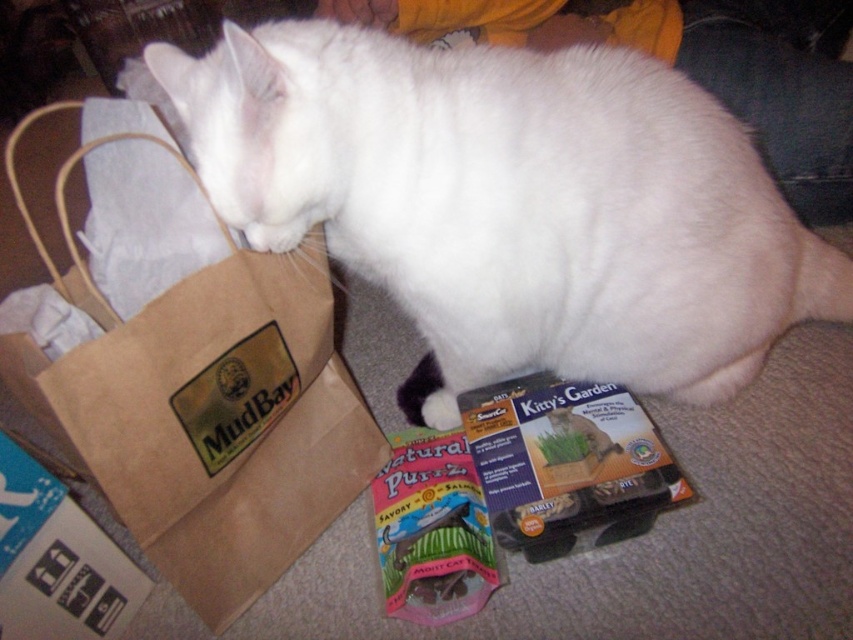
Measure the distance from brown paper bag at left to matte cardboard box at lower center.

brown paper bag at left and matte cardboard box at lower center are 33.41 centimeters apart from each other.

Which of these two, brown paper bag at left or matte cardboard box at lower center, stands taller?

brown paper bag at left

Is point (26, 216) behind point (645, 486)?

That is False.

The width and height of the screenshot is (853, 640). Identify the location of brown paper bag at left. (202, 404).

Can you confirm if white fur cat at upper left is bigger than blue cardboard box at lower left?

Yes.

Between white fur cat at upper left and blue cardboard box at lower left, which one appears on the right side from the viewer's perspective?

white fur cat at upper left is more to the right.

Which is behind, point (788, 323) or point (25, 636)?

The point (788, 323) is behind.

Locate an element on the screen. The width and height of the screenshot is (853, 640). white fur cat at upper left is located at coordinates (509, 204).

Find the location of a particular element. The width and height of the screenshot is (853, 640). brown paper bag at left is located at coordinates (202, 404).

What do you see at coordinates (202, 404) in the screenshot? I see `brown paper bag at left` at bounding box center [202, 404].

Who is more forward, (x=207, y=440) or (x=22, y=563)?

Point (x=207, y=440) is in front.

Identify the location of brown paper bag at left. The width and height of the screenshot is (853, 640). (202, 404).